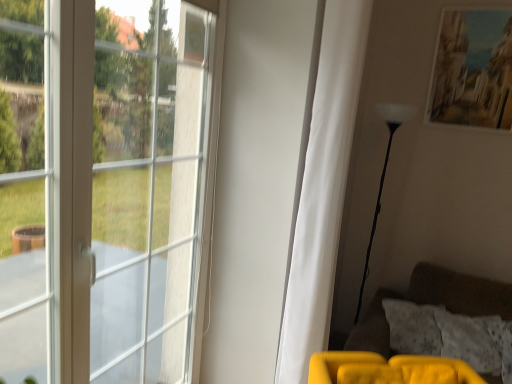
Question: From the image's perspective, is matte paper picture frame at upper right beneath white matte curtain at center?

Choices:
 (A) no
 (B) yes

Answer: (A)

Question: Is matte paper picture frame at upper right aimed at white matte curtain at center?

Choices:
 (A) no
 (B) yes

Answer: (B)

Question: Is matte paper picture frame at upper right at the left side of white matte curtain at center?

Choices:
 (A) no
 (B) yes

Answer: (A)

Question: From the image's perspective, is matte paper picture frame at upper right located above white matte curtain at center?

Choices:
 (A) no
 (B) yes

Answer: (B)

Question: Is white matte curtain at center located within matte paper picture frame at upper right?

Choices:
 (A) yes
 (B) no

Answer: (B)

Question: Is matte paper picture frame at upper right situated inside white matte curtain at center or outside?

Choices:
 (A) outside
 (B) inside

Answer: (A)

Question: Is matte paper picture frame at upper right taller or shorter than white matte curtain at center?

Choices:
 (A) tall
 (B) short

Answer: (B)

Question: From a real-world perspective, is matte paper picture frame at upper right physically located above or below white matte curtain at center?

Choices:
 (A) below
 (B) above

Answer: (B)

Question: In terms of width, does matte paper picture frame at upper right look wider or thinner when compared to white matte curtain at center?

Choices:
 (A) wide
 (B) thin

Answer: (B)

Question: Is white glossy floor lamp at right wider or thinner than fluffy white pillow at lower right?

Choices:
 (A) thin
 (B) wide

Answer: (A)

Question: From a real-world perspective, is white glossy floor lamp at right physically located above or below fluffy white pillow at lower right?

Choices:
 (A) below
 (B) above

Answer: (B)

Question: Is white glossy floor lamp at right inside the boundaries of fluffy white pillow at lower right, or outside?

Choices:
 (A) outside
 (B) inside

Answer: (A)

Question: Is white glossy floor lamp at right bigger or smaller than fluffy white pillow at lower right?

Choices:
 (A) small
 (B) big

Answer: (B)

Question: Which is correct: velvet yellow couch at lower right is inside white matte curtain at center, or outside of it?

Choices:
 (A) inside
 (B) outside

Answer: (B)

Question: Is point (350, 360) closer or farther from the camera than point (349, 157)?

Choices:
 (A) farther
 (B) closer

Answer: (B)